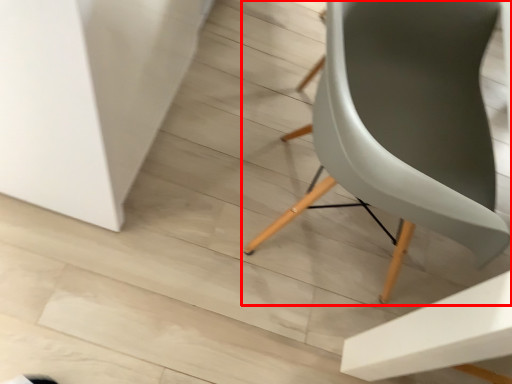
Question: From the image's perspective, where is chair (annotated by the red box) located in relation to table in the image?

Choices:
 (A) above
 (B) below

Answer: (B)